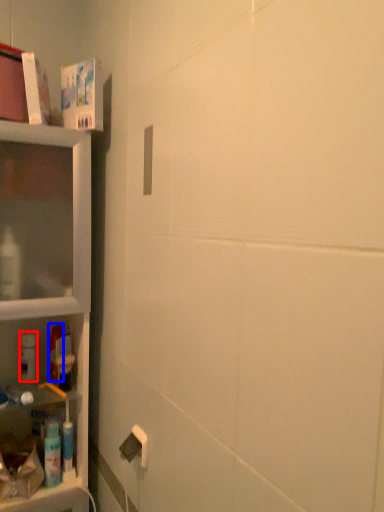
Question: Which object appears closest to the camera in this image, cleaning product (highlighted by a red box) or mouthwash (highlighted by a blue box)?

Choices:
 (A) cleaning product
 (B) mouthwash

Answer: (A)